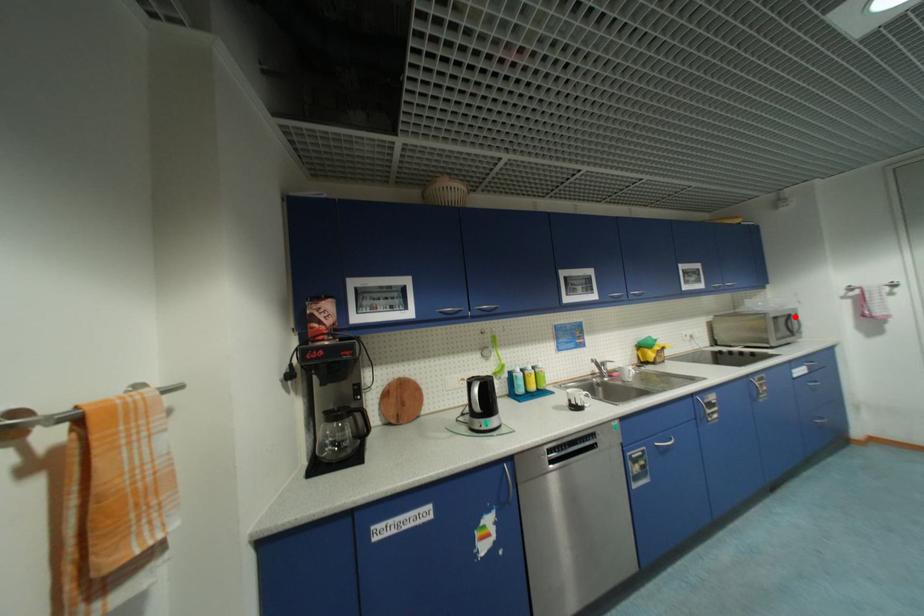
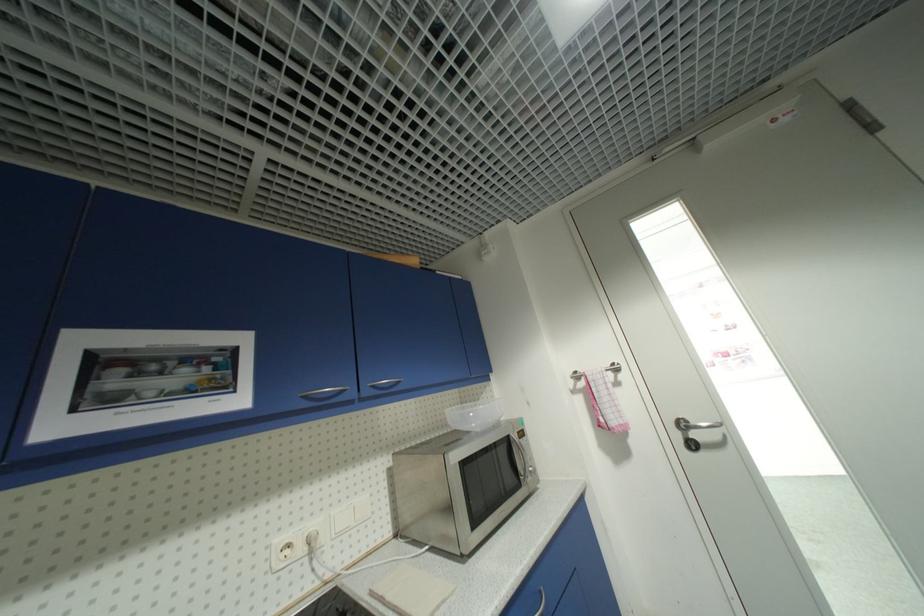
Find the pixel in the second image that matches the highlighted location in the first image.

(514, 440)